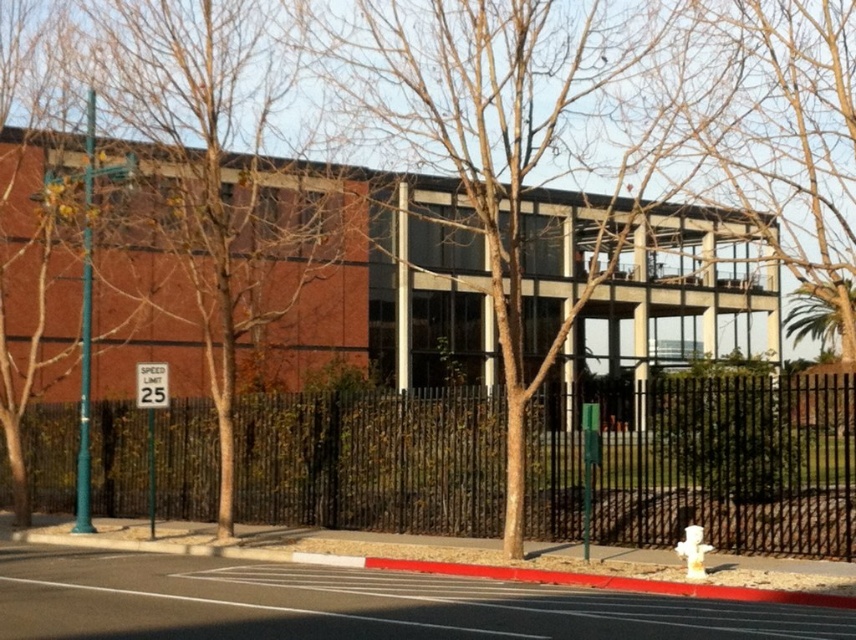
You are standing in front of the modern building and want to locate the white plastic hydrant at lower right. Which direction should you look relative to the black metal fence at center?

The white plastic hydrant at lower right is to the right of the black metal fence at center, so you should look to the right side of the black metal fence at center to find it.

You are a delivery person trying to see the building entrance. You are standing behind the black metal fence at center and the white plastic hydrant at lower right. Which object is blocking your view more because of its height?

The black metal fence at center is taller than the white plastic hydrant at lower right, so it is blocking your view more due to its greater height.

You are standing in front of the building and want to walk from point A to point B. Point A is located at coordinates point [603,35] and point B is at point [688,547]. Which point is closer to you?

Point [688,547] is closer to you because it is in front of point [603,35].